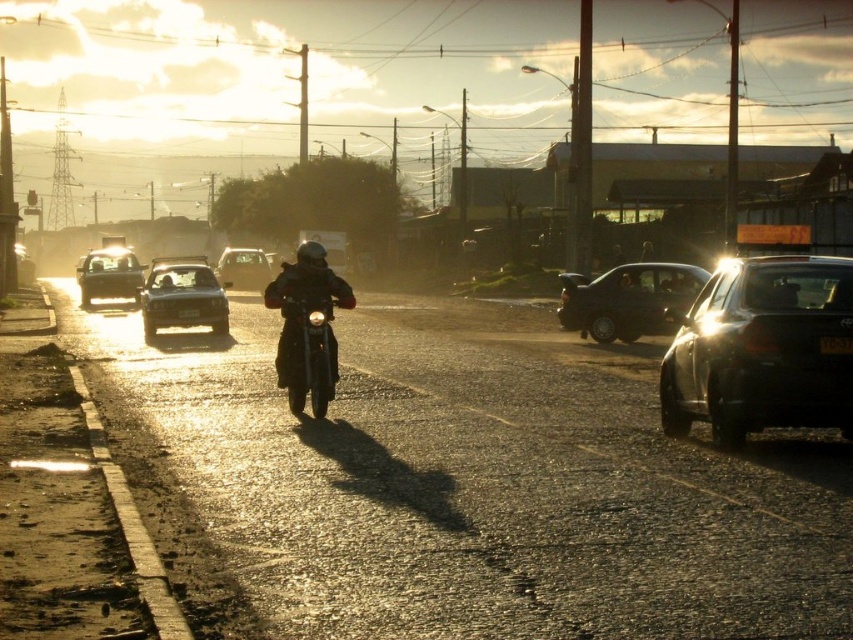
Question: Can you confirm if shiny silver sedan at left is thinner than metallic silver sedan at center?

Choices:
 (A) no
 (B) yes

Answer: (B)

Question: Is black glossy sedan at center right below shiny silver sedan at left?

Choices:
 (A) yes
 (B) no

Answer: (A)

Question: Which is nearer to the shiny black sedan at center?

Choices:
 (A) metallic silver sedan at center
 (B) black glossy sedan at center right

Answer: (A)

Question: Which of these objects is positioned closest to the satin black sedan at right?

Choices:
 (A) shiny black sedan at center
 (B) shiny silver sedan at left

Answer: (A)

Question: Which of the following is the farthest from the observer?

Choices:
 (A) satin black sedan at right
 (B) shiny chrome motorcycle at center
 (C) shiny black sedan at center
 (D) black glossy sedan at center right

Answer: (C)

Question: Can you confirm if black glossy sedan at center right is positioned to the right of metallic silver sedan at center?

Choices:
 (A) yes
 (B) no

Answer: (A)